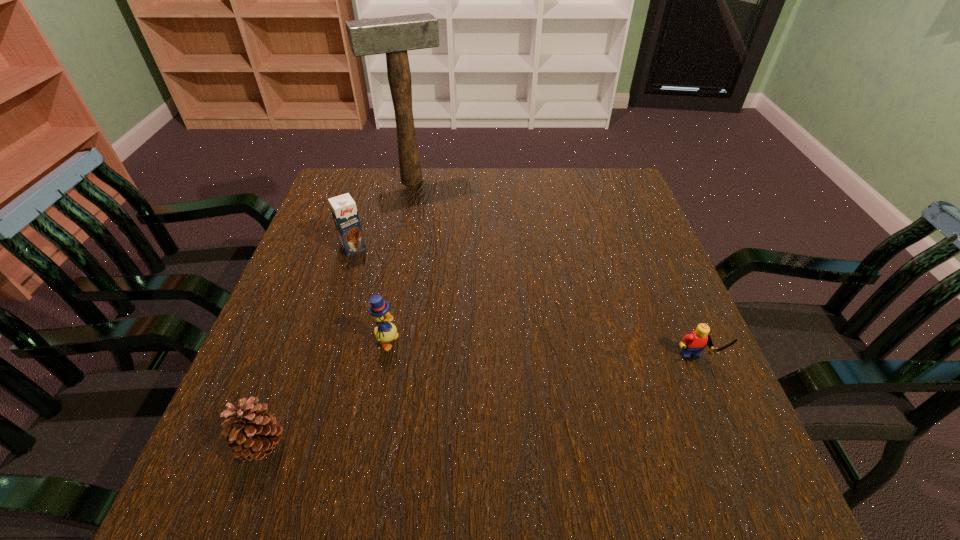
Identify the location of vacant space on the desktop that is between the nearest object and the Lego and is positioned on the front label of the chocolate milk. Image resolution: width=960 pixels, height=540 pixels. [454, 410].

Where is `vacant space on the desktop that is between the nearest object and the rightmost object and is positioned on the face of the duckling, where the monocle is placed`? The height and width of the screenshot is (540, 960). vacant space on the desktop that is between the nearest object and the rightmost object and is positioned on the face of the duckling, where the monocle is placed is located at coordinates (553, 392).

Image resolution: width=960 pixels, height=540 pixels. What are the coordinates of `vacant space on the desktop that is between the nearest object and the rightmost object and is positioned on the striking surface of the tallest object` in the screenshot? It's located at (523, 397).